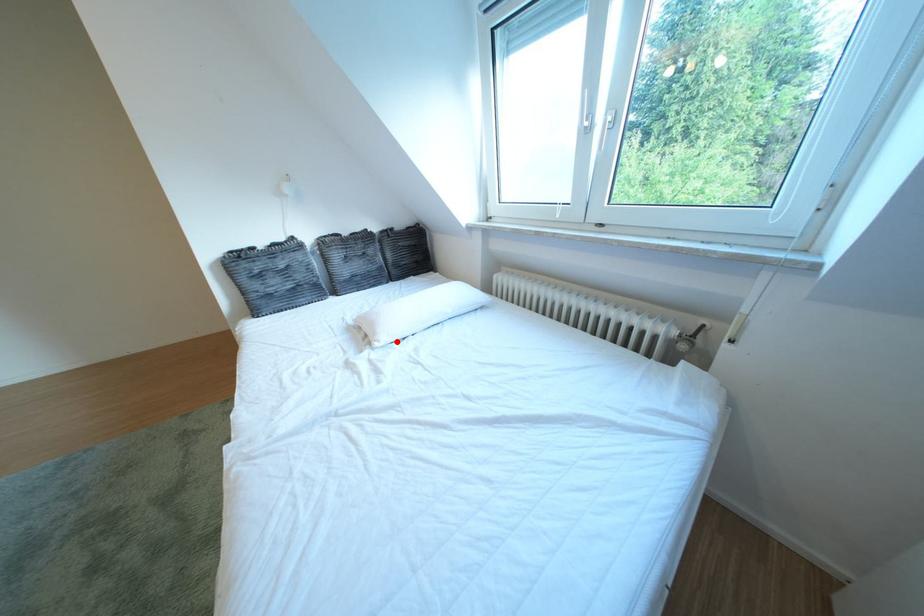
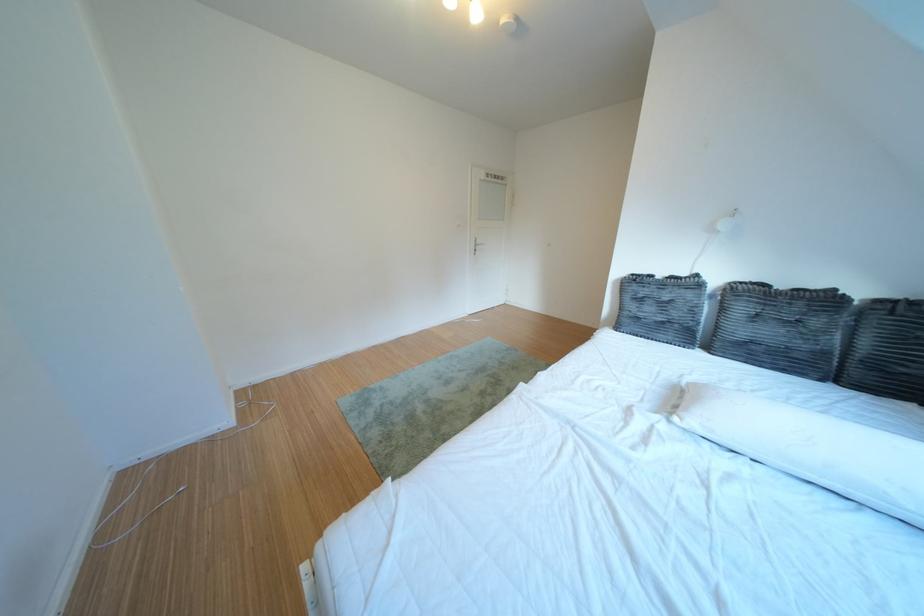
Where in the second image is the point corresponding to the highlighted location from the first image?

(707, 424)